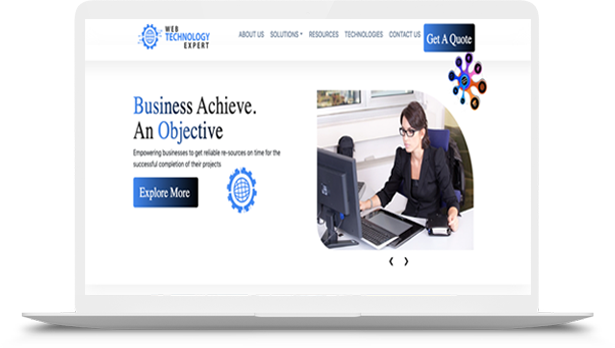
You are a GUI agent. You are given a task and a screenshot of the screen. Output one action in this format:
    pyautogui.click(x=<x>, y=<y>)
    Task: Click on the computer
    
    Given the screenshot: What is the action you would take?
    pyautogui.click(x=336, y=192)